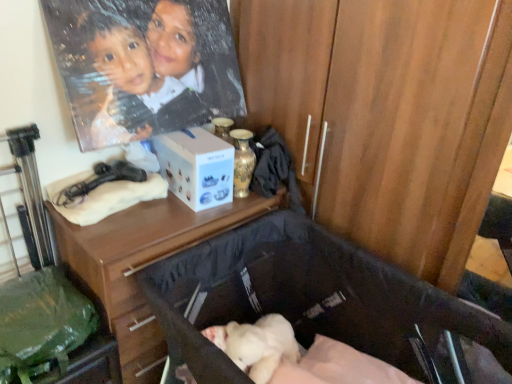
Question: Is gold metallic vase at upper center to the left of matte black hairdryer at upper left from the viewer's perspective?

Choices:
 (A) yes
 (B) no

Answer: (B)

Question: Is matte black hairdryer at upper left a part of gold metallic vase at upper center?

Choices:
 (A) yes
 (B) no

Answer: (B)

Question: Is gold metallic vase at upper center outside matte black hairdryer at upper left?

Choices:
 (A) no
 (B) yes

Answer: (B)

Question: Is gold metallic vase at upper center wider than matte black hairdryer at upper left?

Choices:
 (A) no
 (B) yes

Answer: (A)

Question: Is the depth of gold metallic vase at upper center less than that of matte black hairdryer at upper left?

Choices:
 (A) yes
 (B) no

Answer: (B)

Question: Does gold metallic vase at upper center have a lesser width compared to matte black hairdryer at upper left?

Choices:
 (A) no
 (B) yes

Answer: (B)

Question: Is gold metallic vase at upper center not inside white matte box at center?

Choices:
 (A) no
 (B) yes

Answer: (B)

Question: From the image's perspective, does gold metallic vase at upper center appear lower than white matte box at center?

Choices:
 (A) yes
 (B) no

Answer: (A)

Question: Does gold metallic vase at upper center have a smaller size compared to white matte box at center?

Choices:
 (A) no
 (B) yes

Answer: (B)

Question: Does gold metallic vase at upper center come in front of white matte box at center?

Choices:
 (A) yes
 (B) no

Answer: (B)

Question: From a real-world perspective, is gold metallic vase at upper center located beneath white matte box at center?

Choices:
 (A) yes
 (B) no

Answer: (B)

Question: From a real-world perspective, is gold metallic vase at upper center located higher than white matte box at center?

Choices:
 (A) yes
 (B) no

Answer: (A)

Question: Is white matte box at center to the left of green fabric bag at lower left from the viewer's perspective?

Choices:
 (A) yes
 (B) no

Answer: (B)